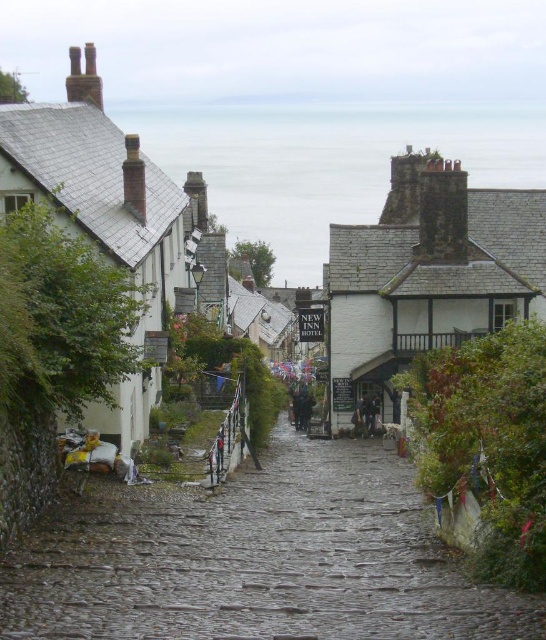
You are a delivery person with a cart that is 1.5 meters wide. You need to deliver packages along the cobblestone path at center to the white stone village at center. Is the path wide enough for your cart to pass through?

The distance between the cobblestone path at center and the white stone village at center is 17.85 meters. However, this measurement refers to the distance between the two objects, not the width of the path itself. Since the question is about the path width, there isnecessary information provided to determine if the cart can pass. Please check the path width details.

You are a tourist walking along the cobblestone path at center and the white stone village at center. Which object is closer to the ground?

The cobblestone path at center is positioned under the white stone village at center, so the cobblestone path at center is closer to the ground.

You are a tourist walking down the cobblestone path at center and want to reach the white stone village at center. Which direction should you move to get closer to the village?

The cobblestone path at center is positioned on the left side of the white stone village at center. To get closer to the village, you should move to the right from the cobblestone path at center.